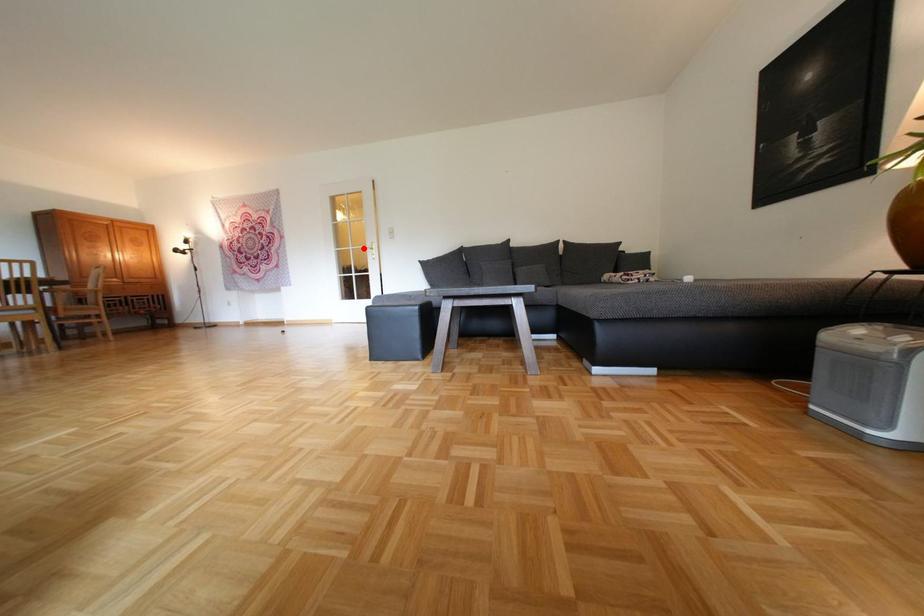
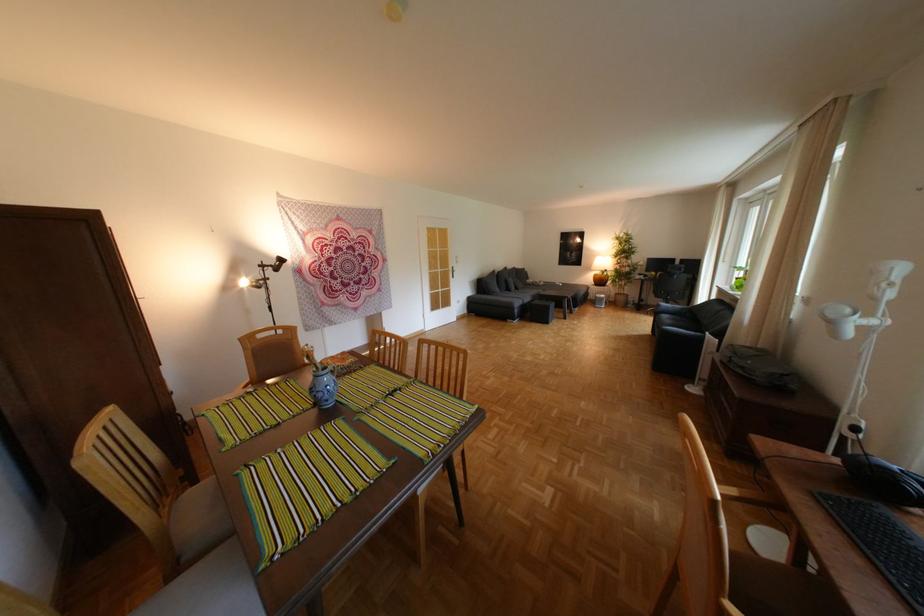
The point at the highlighted location is marked in the first image. Where is the corresponding point in the second image?

(453, 270)